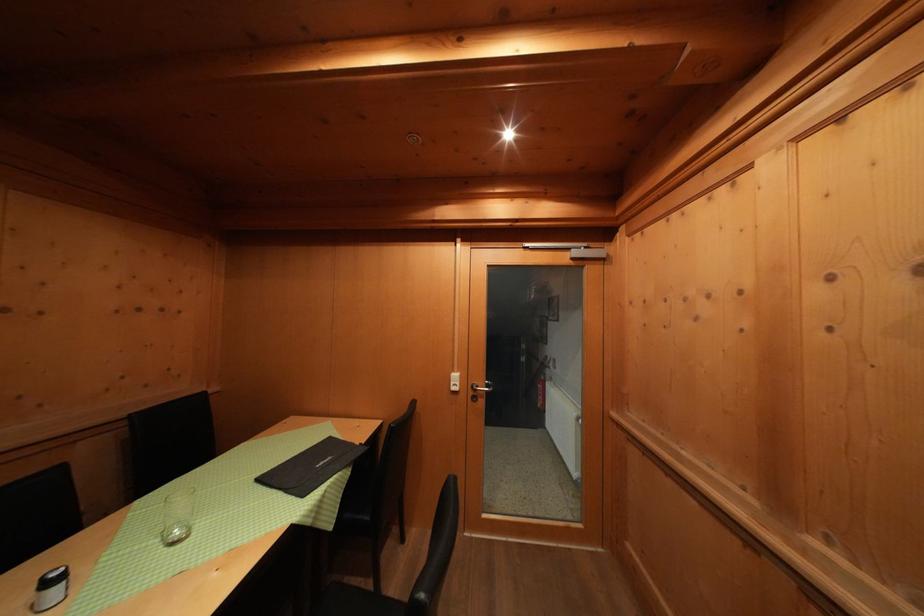
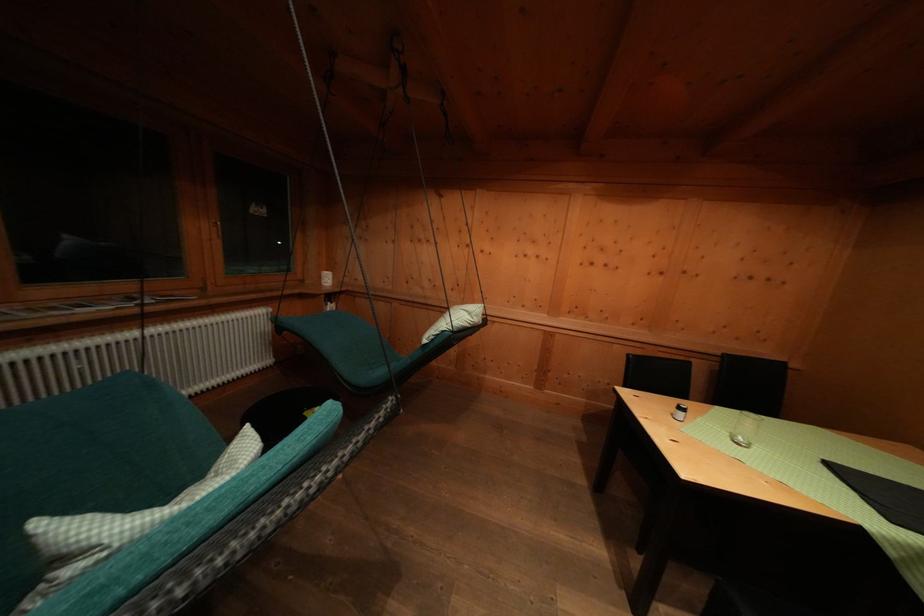
Question: How did the camera likely rotate?

Choices:
 (A) Left
 (B) Right
 (C) Up
 (D) Down

Answer: (A)